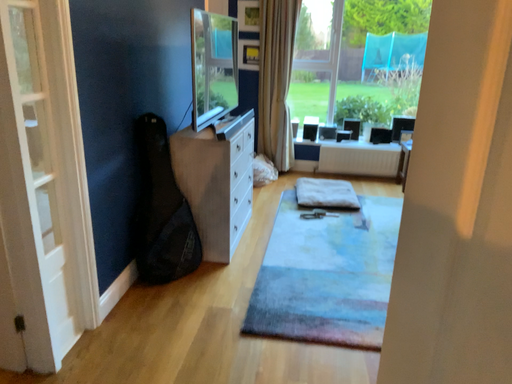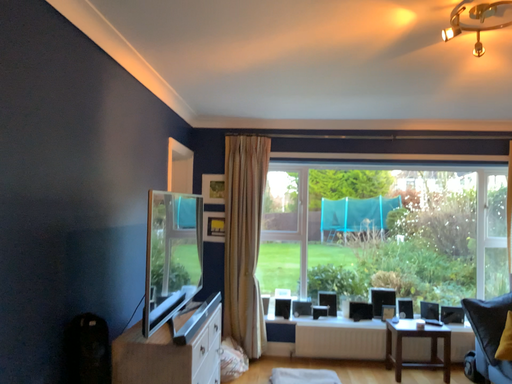
Question: How did the camera likely rotate when shooting the video?

Choices:
 (A) rotated upward
 (B) rotated downward

Answer: (A)